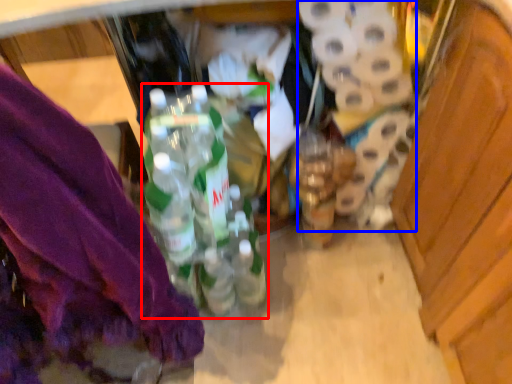
Question: Which of the following is the closest to the observer, bottle (highlighted by a red box) or toilet paper (highlighted by a blue box)?

Choices:
 (A) bottle
 (B) toilet paper

Answer: (A)